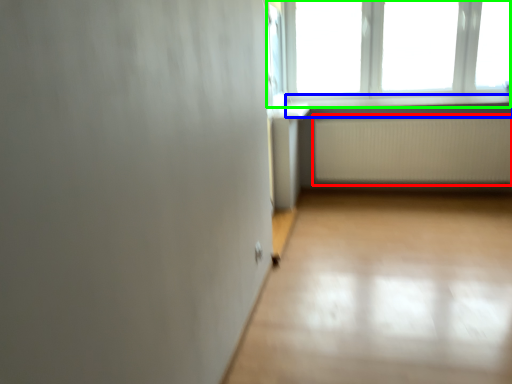
Question: Which object is the farthest from radiator (highlighted by a red box)? Choose among these: window sill (highlighted by a blue box) or window (highlighted by a green box).

Choices:
 (A) window sill
 (B) window

Answer: (B)